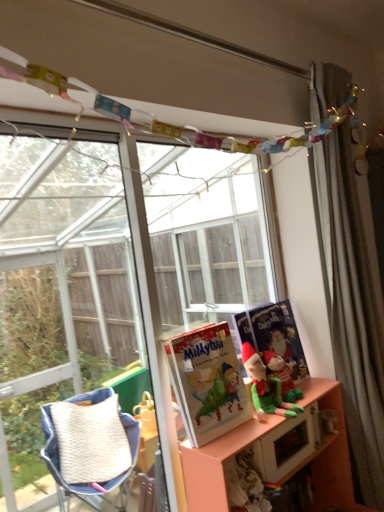
Locate an element on the screen. Image resolution: width=384 pixels, height=512 pixels. free spot to the right of green fabric elf at center is located at coordinates (310, 389).